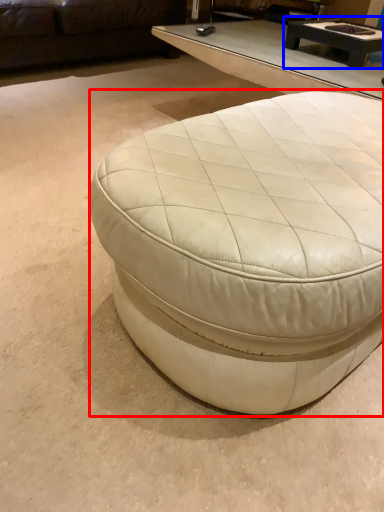
Question: Which point is further to the camera, coffee table (highlighted by a red box) or coffee table (highlighted by a blue box)?

Choices:
 (A) coffee table
 (B) coffee table

Answer: (B)